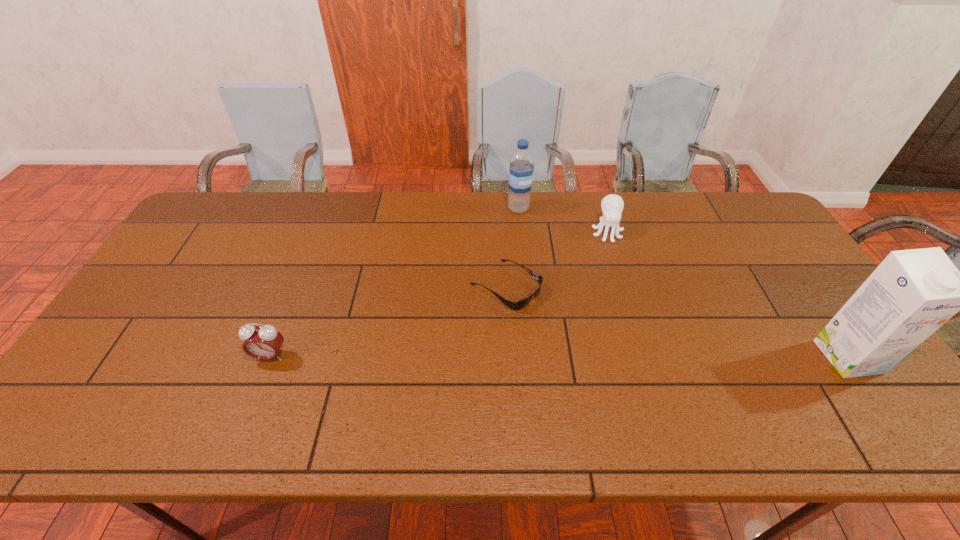
At what (x,y) coordinates should I click in order to perform the action: click on water bottle located at the far edge. Please return your answer as a coordinate pair (x, y). Image resolution: width=960 pixels, height=540 pixels. Looking at the image, I should click on (521, 169).

Identify the location of octopus present at the far edge. The height and width of the screenshot is (540, 960). (612, 205).

This screenshot has height=540, width=960. Find the location of `object at the near edge`. object at the near edge is located at coordinates (912, 293).

You are a GUI agent. You are given a task and a screenshot of the screen. Output one action in this format:
    pyautogui.click(x=<x>, y=<y>)
    Task: Click on the object at the right edge
    Image resolution: width=960 pixels, height=540 pixels.
    Given the screenshot: What is the action you would take?
    pyautogui.click(x=912, y=293)

The image size is (960, 540). In order to click on object that is at the near right corner in this screenshot , I will do `click(912, 293)`.

At what (x,y) coordinates should I click in order to perform the action: click on vacant space at the far edge. Please return your answer as a coordinate pair (x, y). Looking at the image, I should click on (534, 227).

Where is `vacant space at the near edge`? The width and height of the screenshot is (960, 540). vacant space at the near edge is located at coordinates (621, 387).

Where is `vacant space at the right edge of the desktop`? The image size is (960, 540). vacant space at the right edge of the desktop is located at coordinates (762, 291).

You are a GUI agent. You are given a task and a screenshot of the screen. Output one action in this format:
    pyautogui.click(x=<x>, y=<y>)
    Task: Click on the empty space that is in between the second farthest object and the alarm clock
    This screenshot has height=540, width=960.
    Given the screenshot: What is the action you would take?
    pyautogui.click(x=439, y=294)

Image resolution: width=960 pixels, height=540 pixels. Identify the location of free space between the sunglasses and the alarm clock. (388, 320).